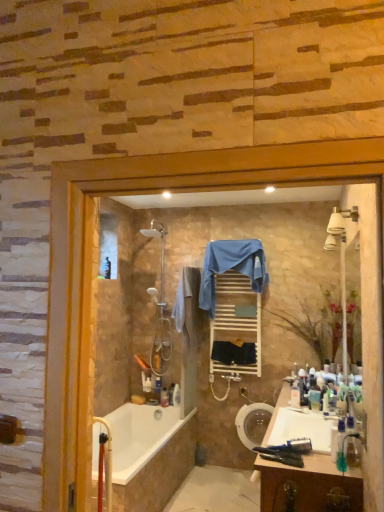
I want to click on free space above white glossy sink at lower right (from a real-world perspective), so click(x=304, y=422).